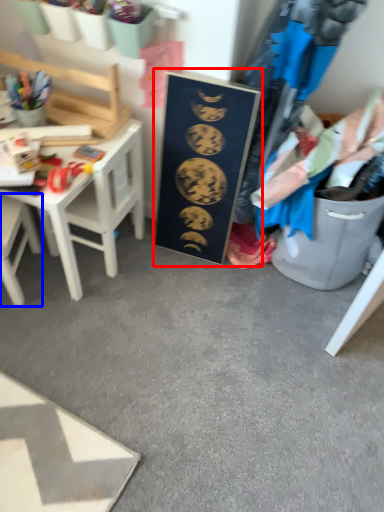
Question: Which object is closer to the camera taking this photo, bulletin board (highlighted by a red box) or chair (highlighted by a blue box)?

Choices:
 (A) bulletin board
 (B) chair

Answer: (B)